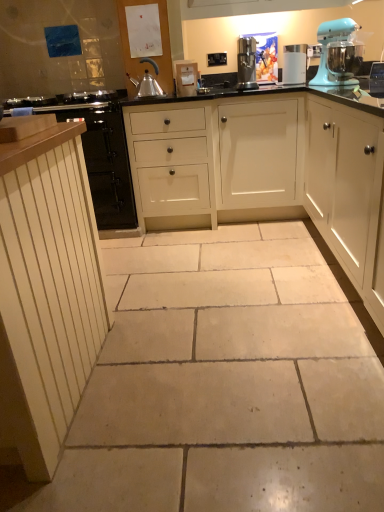
Question: From a real-world perspective, is white matte cabinet at right, which ranks as the 4th cabinetry in left-to-right order, above or below white wood cabinets at center, positioned as the 3th cabinetry in left-to-right order?

Choices:
 (A) above
 (B) below

Answer: (B)

Question: From the image's perspective, relative to white wood cabinets at center, positioned as the 3th cabinetry in left-to-right order, is white matte cabinet at right, the first cabinetry when ordered from right to left, above or below?

Choices:
 (A) above
 (B) below

Answer: (B)

Question: Which object is the closest to the light blue plastic stand mixer at upper right?

Choices:
 (A) white glossy water filter at upper center, which appears as the second kitchen appliance when viewed from the left
 (B) white wood cabinet at left, positioned as the third cabinetry in right-to-left order
 (C) beige stone floor at center
 (D) white wood cabinet at left, which is counted as the first cabinetry, starting from the left
 (E) white wood cabinets at center, positioned as the 3th cabinetry in left-to-right order

Answer: (A)

Question: Which object is the closest to the white wood cabinets at center, the second cabinetry positioned from the right?

Choices:
 (A) white wood cabinet at left, which ranks as the second cabinetry in left-to-right order
 (B) light blue plastic stand mixer at upper right
 (C) white wood cabinet at left, which is counted as the first cabinetry, starting from the left
 (D) white matte cabinet at right, which ranks as the 4th cabinetry in left-to-right order
 (E) white glossy water filter at upper center, the 1th kitchen appliance viewed from the right

Answer: (C)